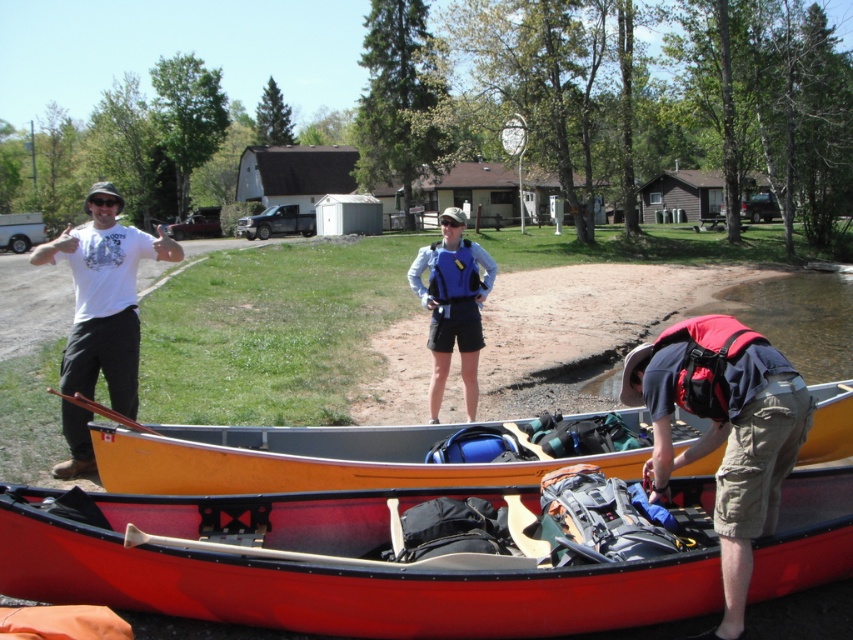
You are standing at the edge of the water and want to place a blue fabric life vest at center into the wooden canoe at center. Based on their positions, can you do this directly without moving either object?

The wooden canoe at center is located below the blue fabric life vest at center, so you can place the blue fabric life vest at center into the wooden canoe at center directly since it is positioned above it.

You are a photographer setting up a shot of the khaki cargo shorts at lower right and the blue fabric life vest at center. Which object should you adjust to ensure both are centered in your frame?

The khaki cargo shorts at lower right is to the right of the blue fabric life vest at center. To center both in the frame, move the khaki cargo shorts at lower right slightly to the left so it aligns with the blue fabric life vest at center.